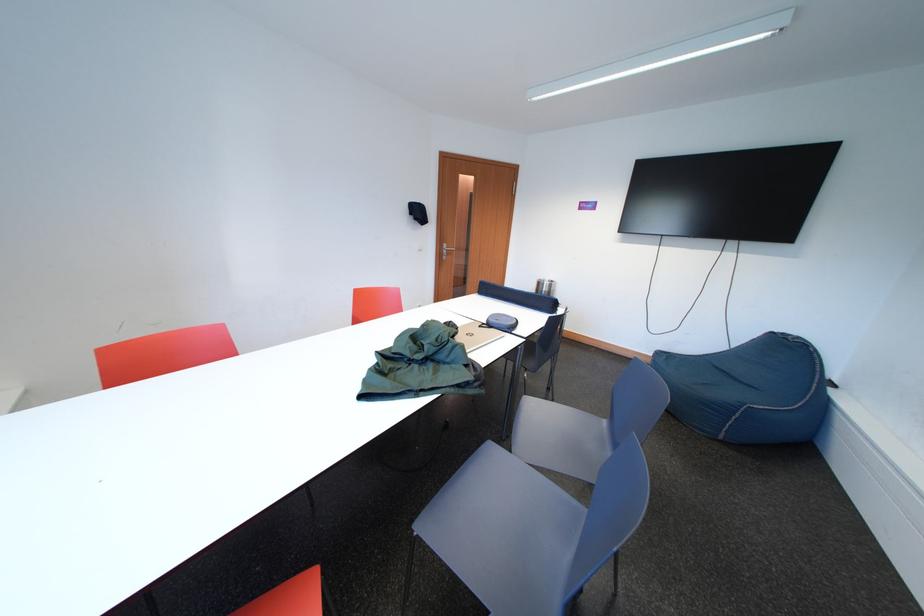
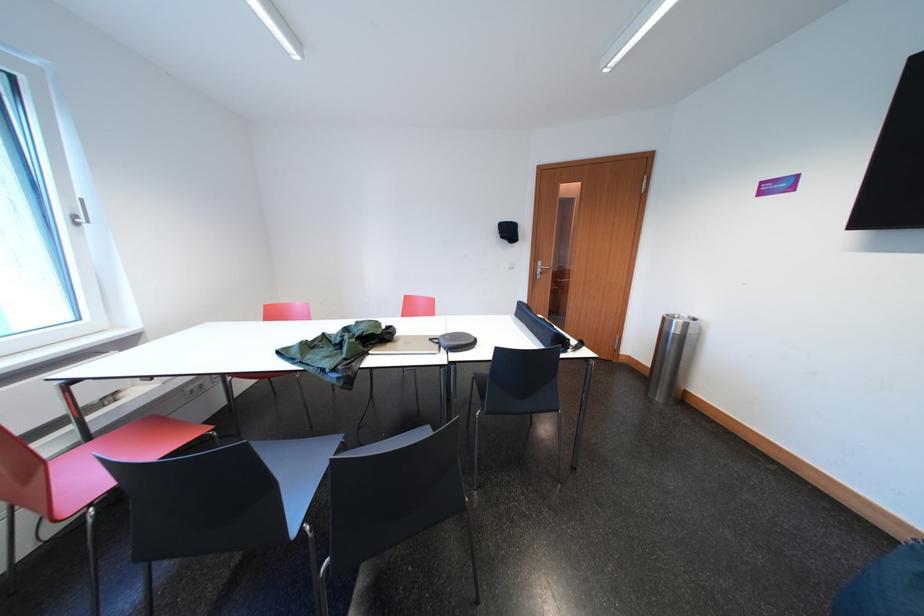
Locate, in the second image, the point that corresponds to pixel 549 288 in the first image.

(675, 325)